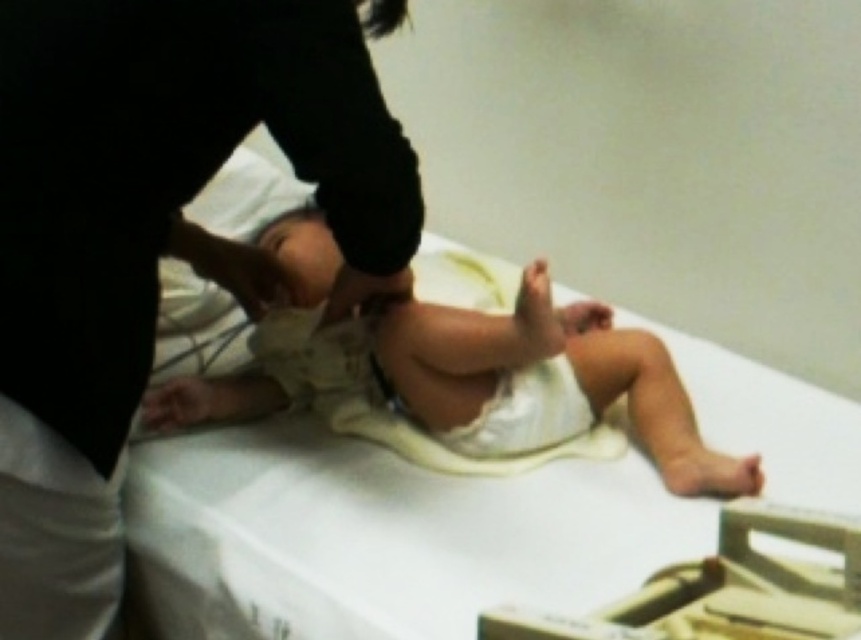
Can you confirm if black fabric at upper left is positioned to the left of light beige fabric baby at center?

Yes, black fabric at upper left is to the left of light beige fabric baby at center.

Who is higher up, black fabric at upper left or light beige fabric baby at center?

Positioned higher is black fabric at upper left.

The width and height of the screenshot is (861, 640). Describe the element at coordinates (153, 236) in the screenshot. I see `black fabric at upper left` at that location.

The image size is (861, 640). In order to click on black fabric at upper left in this screenshot , I will do `click(153, 236)`.